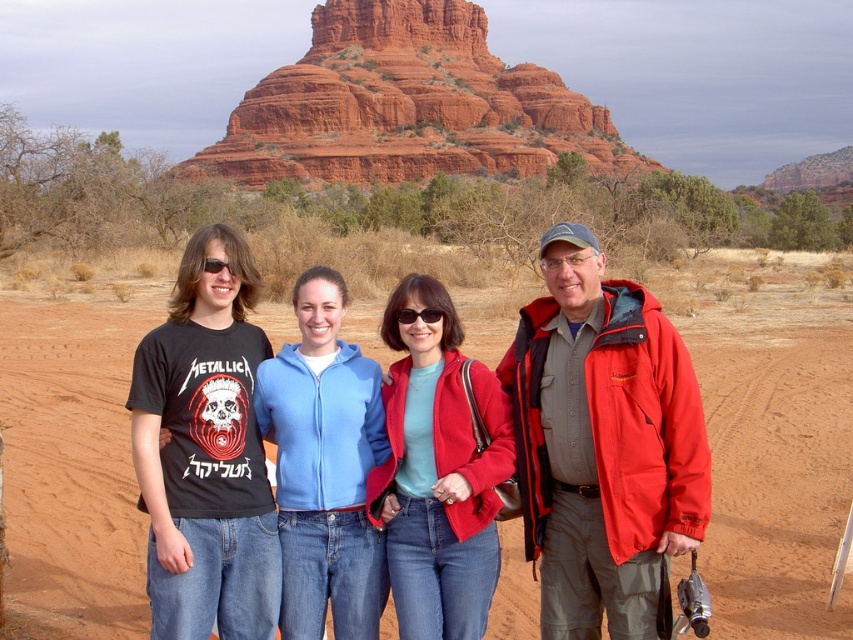
Who is taller, red matte jacket at center or matte red jacket at center?

red matte jacket at center

Is red matte jacket at center smaller than matte red jacket at center?

Incorrect, red matte jacket at center is not smaller in size than matte red jacket at center.

Between point (589, 458) and point (432, 358), which one is positioned in front?

Point (589, 458) is in front.

At what (x,y) coordinates should I click in order to perform the action: click on red matte jacket at center. Please return your answer as a coordinate pair (x, y). This screenshot has width=853, height=640. Looking at the image, I should click on click(602, 442).

Does matte black t-shirt at left have a greater width compared to red matte jacket at center?

Yes.

Can you confirm if matte black t-shirt at left is shorter than red matte jacket at center?

Yes.

I want to click on matte black t-shirt at left, so click(x=602, y=442).

How distant is black matte t-shirt at left from matte red jacket at center?

22.57 feet

Is black matte t-shirt at left behind matte red jacket at center?

No.

The width and height of the screenshot is (853, 640). Find the location of `black matte t-shirt at left`. black matte t-shirt at left is located at coordinates (206, 451).